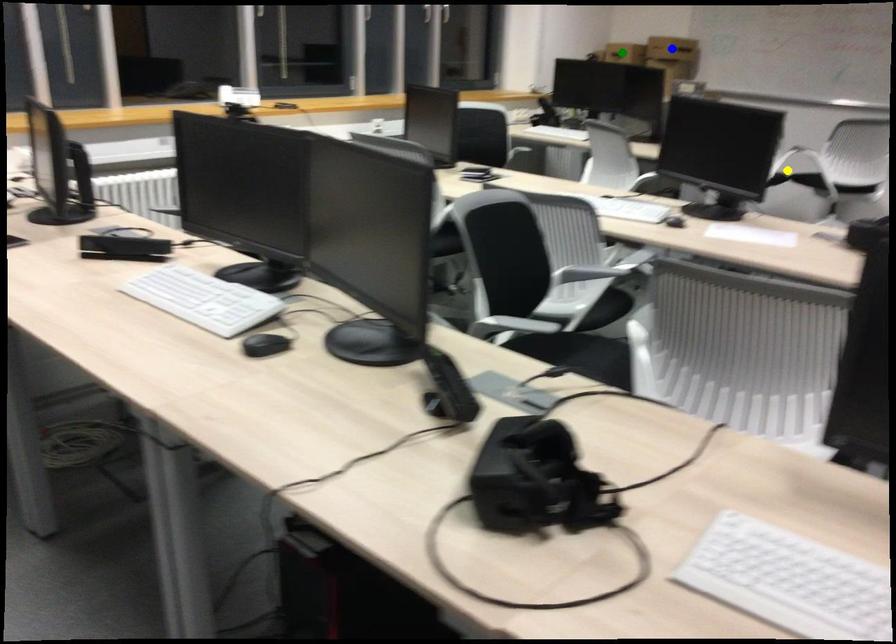
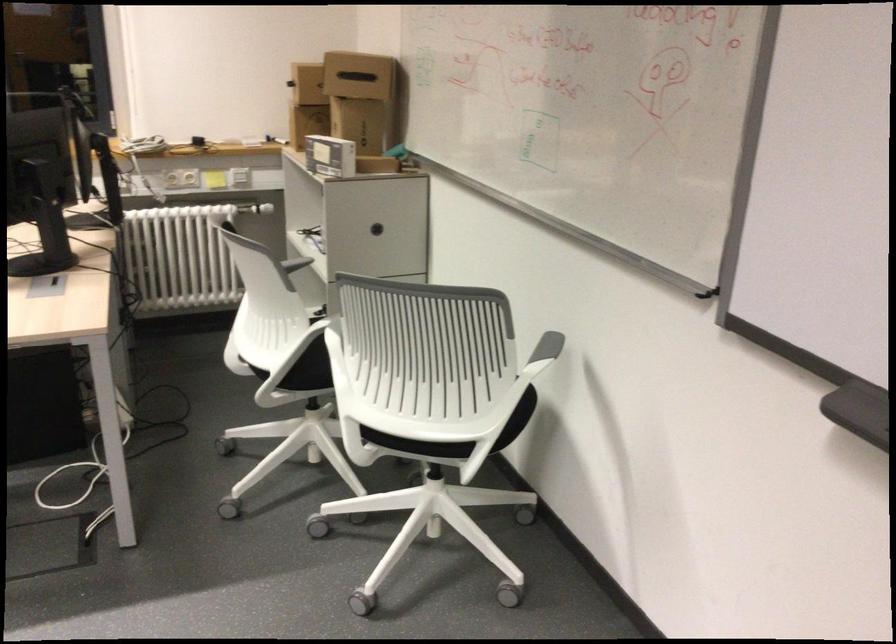
I am providing you with two images of the same scene from different viewpoints. Three points are marked in image1. Which point corresponds to a part or object that is occluded in image2?In image1, three points are marked. Which of them correspond to a part or object that is occluded in image2?Among the three points shown in image1, which one corresponds to a part or object that is no longer visible due to occlusion in image2?

green point, blue point